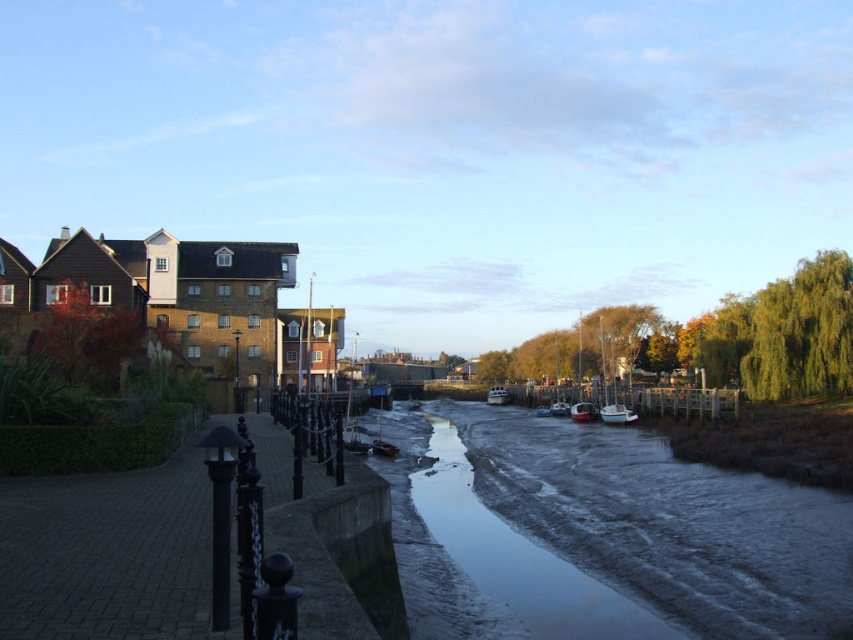
You are a photographer planning to capture the white glossy boat at center and the wooden boat at center in a single frame. Considering their heights, which boat will appear taller in the photo?

The white glossy boat at center will appear taller in the photo because it has a greater height compared to the wooden boat at center.

You are standing at the point marked by the coordinates point [618,413] in the image. What object are you directly facing?

You are directly facing the white matte boat at center marked by the coordinates point [618,413].

You are a photographer planning to capture both the white matte boat at center and the wooden boat at center in a single frame. Given their sizes, which boat should you position closer to the camera to ensure both appear roughly the same size in the photo?

To make both the white matte boat at center and the wooden boat at center appear roughly the same size in the photo, you should position the smaller white matte boat at center closer to the camera than the larger wooden boat at center.